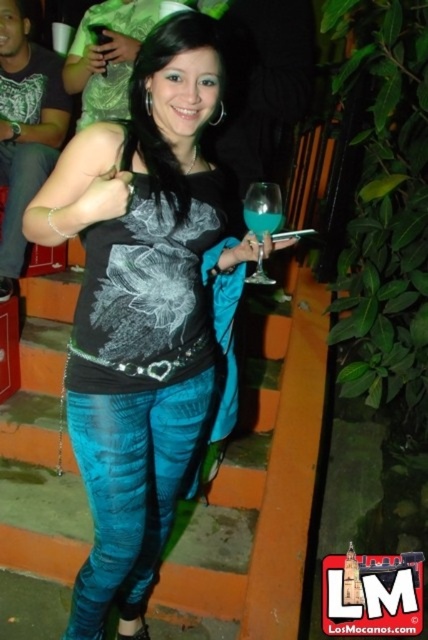
Question: Is matte black tank top at center behind translucent blue glass at center?

Choices:
 (A) yes
 (B) no

Answer: (B)

Question: Which of the following is the closest to the observer?

Choices:
 (A) (92, 381)
 (B) (112, 1)
 (C) (258, 225)

Answer: (C)

Question: Which of the following is the closest to the observer?

Choices:
 (A) (262, 275)
 (B) (258, 221)
 (C) (157, 3)

Answer: (B)

Question: Can you confirm if translucent blue glass at center is bigger than translucent glass at center?

Choices:
 (A) no
 (B) yes

Answer: (B)

Question: Does translucent blue glass at center appear on the left side of translucent glass at center?

Choices:
 (A) yes
 (B) no

Answer: (A)

Question: Which point is farther from the camera taking this photo?

Choices:
 (A) (261, 221)
 (B) (196, 54)
 (C) (279, 202)
 (D) (98, 24)

Answer: (D)